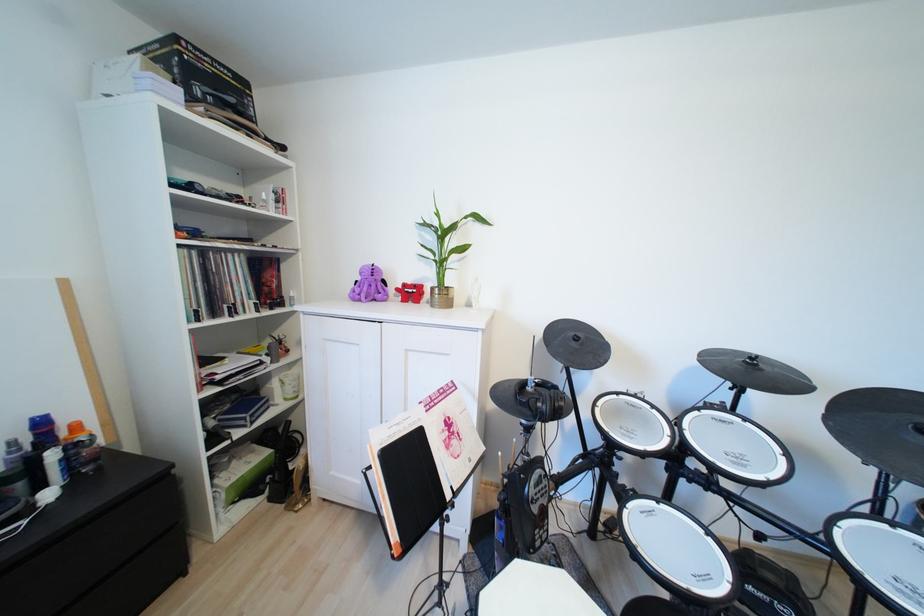
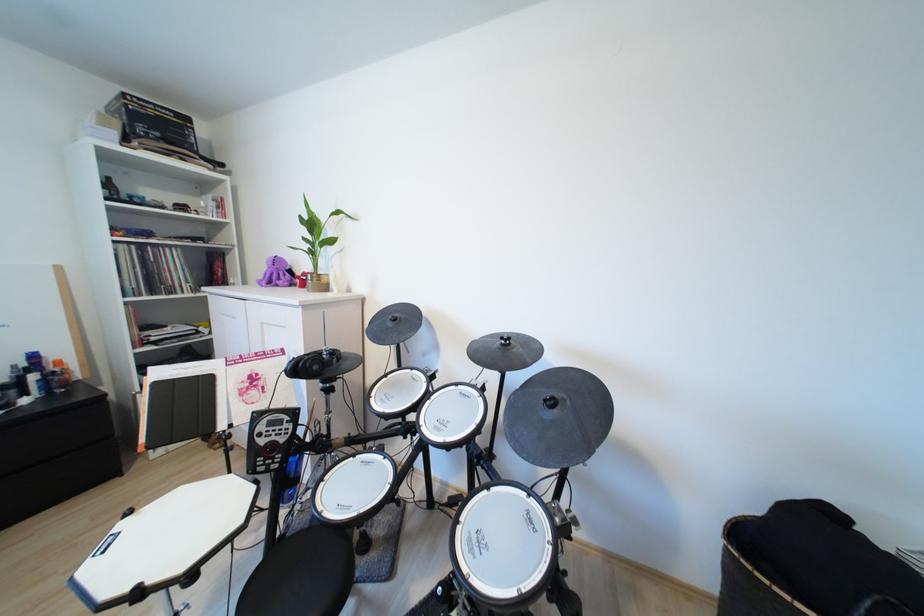
Where in the second image is the point corresponding to [379,288] from the first image?

(289, 277)